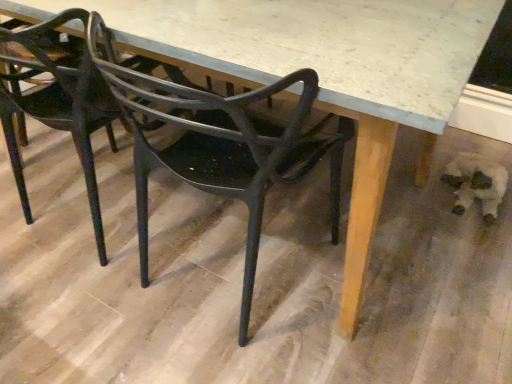
Question: Visually, is matte black chair at center, the 1th chair in the left-to-right sequence, positioned to the left or to the right of matte black chair at center, the second chair positioned from the left?

Choices:
 (A) right
 (B) left

Answer: (B)

Question: Does point (111, 107) appear closer or farther from the camera than point (291, 157)?

Choices:
 (A) farther
 (B) closer

Answer: (A)

Question: Estimate the real-world distances between objects in this image. Which object is farther from the matte black chair at center, the 1th chair in the left-to-right sequence?

Choices:
 (A) matte black chair at center, the second chair positioned from the left
 (B) fuzzy white dog at lower right

Answer: (B)

Question: Which is nearer to the matte black chair at center, the 1th chair in the left-to-right sequence?

Choices:
 (A) matte black chair at center, marked as the first chair in a right-to-left arrangement
 (B) fuzzy white dog at lower right

Answer: (A)